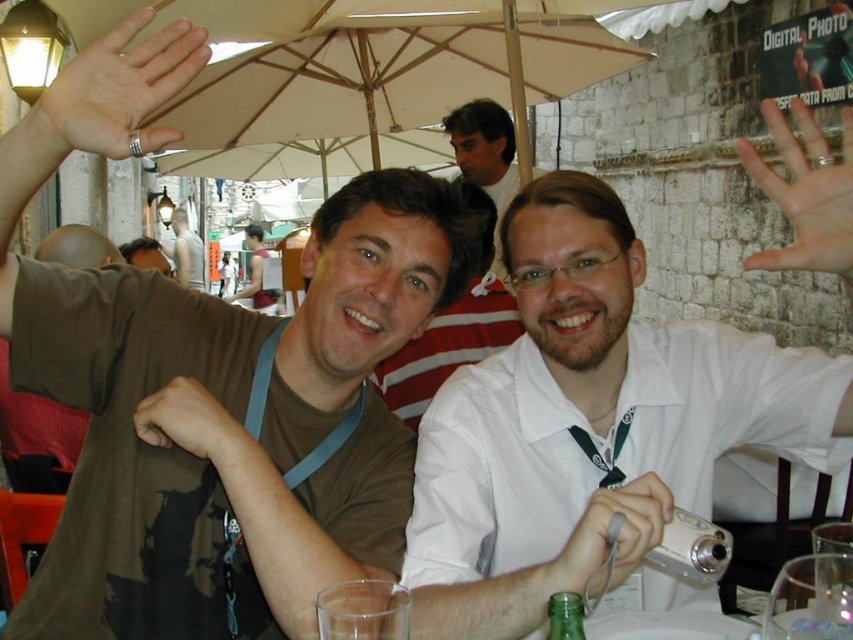
You are a photographer trying to frame a shot that includes both the brown fabric shirt at upper left and the white glossy shirt at center. Based on their positions and sizes, which shirt should you focus on to ensure both are fully visible in the frame?

The brown fabric shirt at upper left might be wider than the white glossy shirt at center, so focusing on the wider brown fabric shirt at upper left would help ensure both are fully visible in the frame.

You are standing in front of the cafe scene and want to know which of the two points, point (36, 100) or point (514, 134), is nearer to you. Can you tell me which one is closer?

Point (36, 100) is closer to the viewer than point (514, 134).